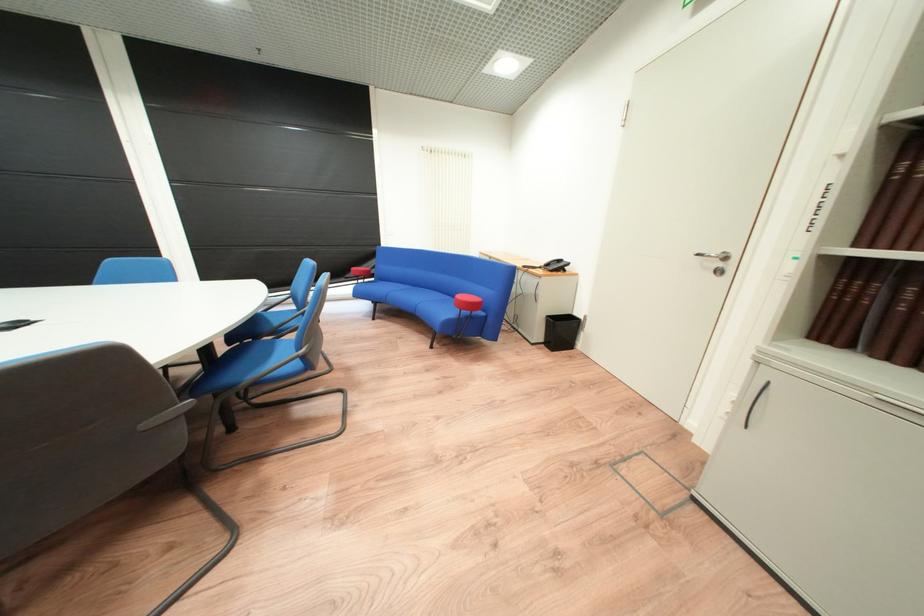
Find where to lift the black telephone. Please return your answer as a coordinate pair (x, y).

(554, 265)